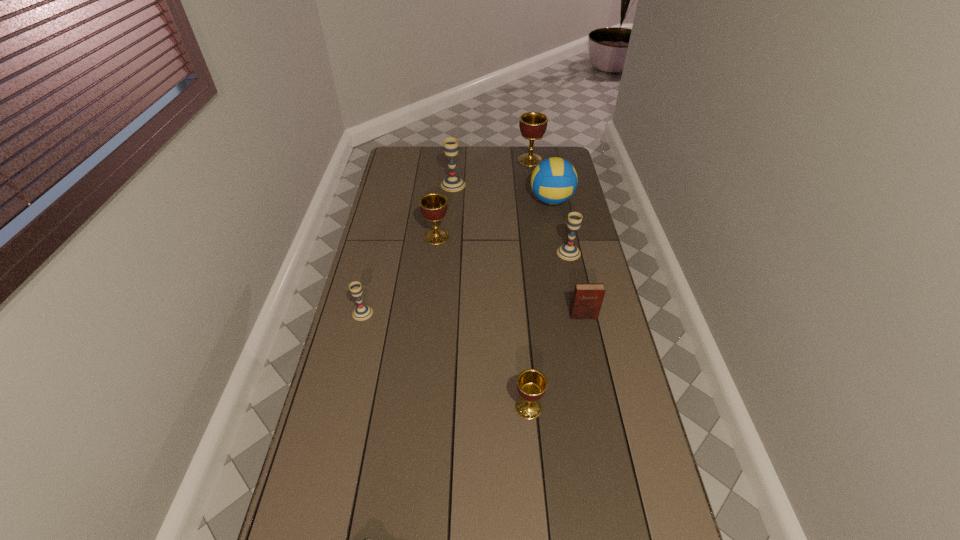
Find the location of a particular element. chalice that is the fifth closest to the second smallest golden chalice is located at coordinates (531, 384).

Identify the location of the third closest chalice relative to the eighth farthest object. The height and width of the screenshot is (540, 960). (433, 206).

Choose which golden chalice is the nearest neighbor to the second nearest golden chalice. Please provide its 2D coordinates. Your answer should be formatted as a tuple, i.e. [(x, y)], where the tuple contains the x and y coordinates of a point satisfying the conditions above.

[(533, 125)]

Locate an element on the screen. golden chalice that is the second closest to the second smallest golden chalice is located at coordinates 531,384.

You are a GUI agent. You are given a task and a screenshot of the screen. Output one action in this format:
    pyautogui.click(x=<x>, y=<y>)
    Task: Click on the closest gray chalice to the second smallest golden chalice
    
    Given the screenshot: What is the action you would take?
    pyautogui.click(x=452, y=183)

Identify the location of gray chalice that is the second nearest to the second biggest gray chalice. (362, 312).

Find the location of a particular element. The height and width of the screenshot is (540, 960). blank area in the image that satisfies the following two spatial constraints: 1. on the back side of the biggest golden chalice; 2. on the right side of the second biggest golden chalice is located at coordinates pos(444,160).

I want to click on free space that satisfies the following two spatial constraints: 1. on the back side of the blue volleyball; 2. on the left side of the leftmost golden chalice, so click(441, 200).